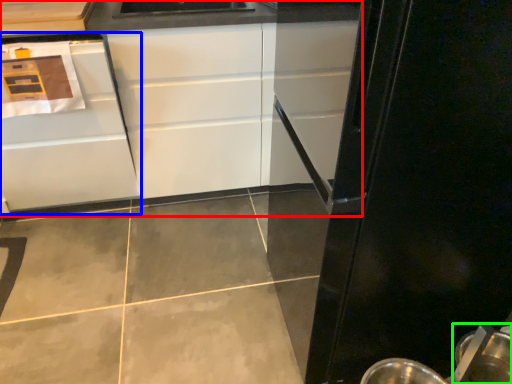
Question: Based on their relative distances, which object is nearer to cabinetry (highlighted by a red box)? Choose from cabinetry (highlighted by a blue box) and appliance (highlighted by a green box).

Choices:
 (A) cabinetry
 (B) appliance

Answer: (A)